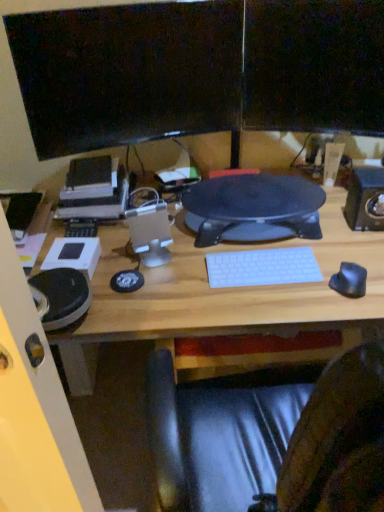
Where is `free location in front of white plastic keyboard at center`? The image size is (384, 512). free location in front of white plastic keyboard at center is located at coordinates (267, 304).